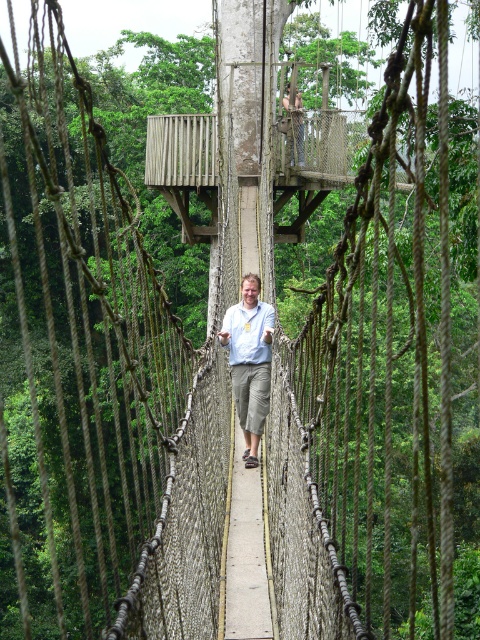
You are a park ranger assessing safety conditions on the suspension bridge. You notice the wooden platform at upper center and the matte blue shirt at center. Which object is bigger in size?

The wooden platform at upper center is larger in size than the matte blue shirt at center.

You are a hiker who has just reached the middle of a suspension bridge. You notice the matte blue shirt at center and the matte gray pants at center. Which clothing item is positioned lower on your body?

The matte blue shirt at center is positioned below the matte gray pants at center, so the shirt is lower on the body.

You are standing on the suspension bridge and notice two points marked on the walkway. The first point is at coordinates point (201, 161) and the second is at point (256, 440). If you are facing the direction of the bridge, which point is closer to the starting end of the bridge?

Point (201, 161) is behind point (256, 440), so the point closer to the starting end of the bridge is point (201, 161).